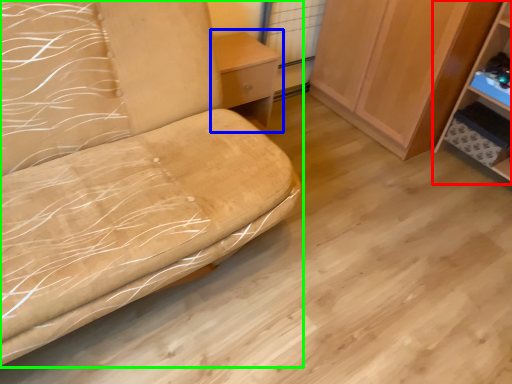
Question: Estimate the real-world distances between objects in this image. Which object is farther from shelf (highlighted by a red box), table (highlighted by a blue box) or furniture (highlighted by a green box)?

Choices:
 (A) table
 (B) furniture

Answer: (B)